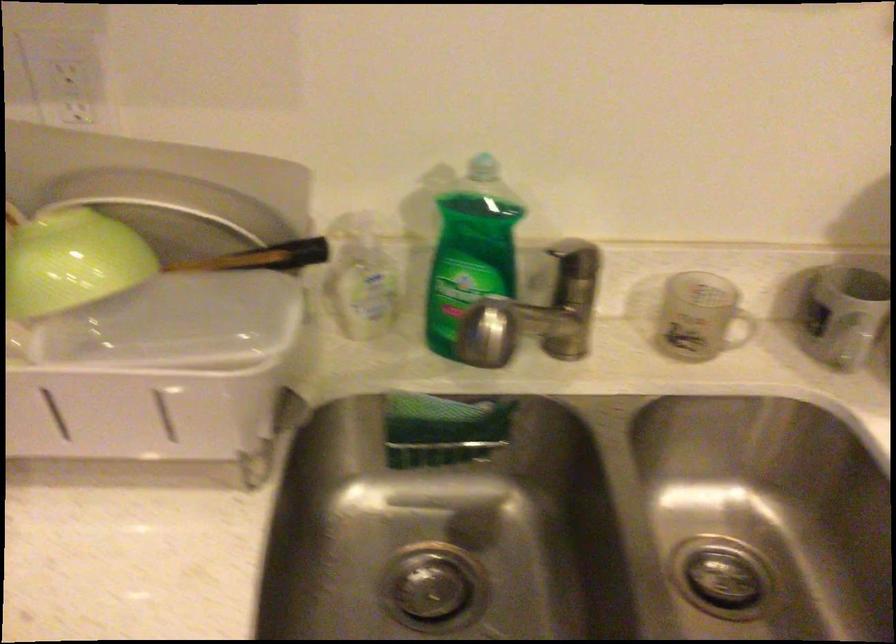
Find where to lift the faucet handle. Please return your answer as a coordinate pair (x, y).

(572, 306)